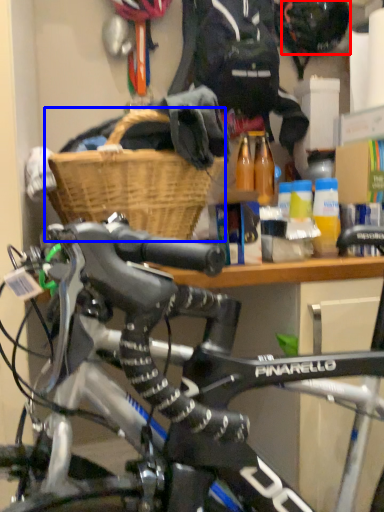
Question: Which point is closer to the camera, bicycle helmet (highlighted by a red box) or basket (highlighted by a blue box)?

Choices:
 (A) bicycle helmet
 (B) basket

Answer: (B)